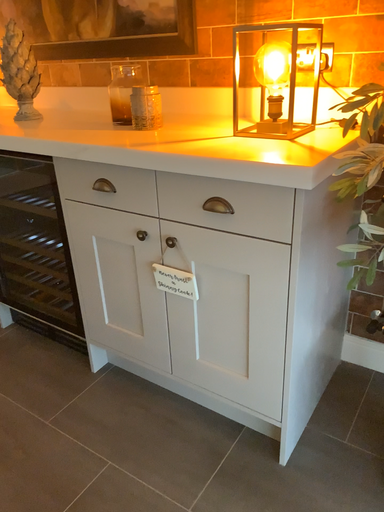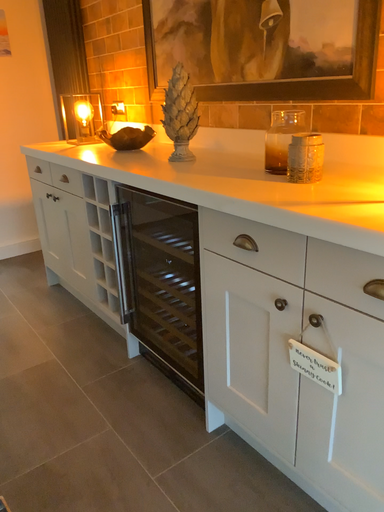
Question: Which way did the camera rotate in the video?

Choices:
 (A) rotated left
 (B) rotated right

Answer: (A)